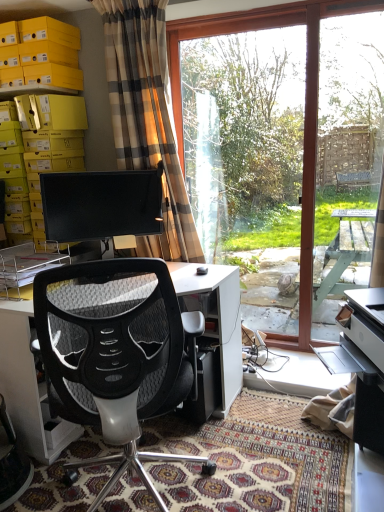
Question: From a real-world perspective, is black glossy monitor at center located beneath yellow cardboard boxes at upper left?

Choices:
 (A) yes
 (B) no

Answer: (A)

Question: Would you say black glossy monitor at center is outside yellow cardboard boxes at upper left?

Choices:
 (A) yes
 (B) no

Answer: (A)

Question: Considering the relative sizes of black glossy monitor at center and yellow cardboard boxes at upper left in the image provided, is black glossy monitor at center bigger than yellow cardboard boxes at upper left?

Choices:
 (A) yes
 (B) no

Answer: (B)

Question: Is black glossy monitor at center shorter than yellow cardboard boxes at upper left?

Choices:
 (A) no
 (B) yes

Answer: (B)

Question: Is black glossy monitor at center directly adjacent to yellow cardboard boxes at upper left?

Choices:
 (A) no
 (B) yes

Answer: (A)

Question: From their relative heights in the image, would you say black glossy monitor at center is taller or shorter than transparent glass screen door at right?

Choices:
 (A) tall
 (B) short

Answer: (B)

Question: Based on their sizes in the image, would you say black glossy monitor at center is bigger or smaller than transparent glass screen door at right?

Choices:
 (A) small
 (B) big

Answer: (A)

Question: From the image's perspective, is black glossy monitor at center above or below transparent glass screen door at right?

Choices:
 (A) above
 (B) below

Answer: (B)

Question: Is point (99, 179) positioned closer to the camera than point (369, 48)?

Choices:
 (A) farther
 (B) closer

Answer: (A)

Question: In terms of width, does transparent glass window at center look wider or thinner when compared to transparent glass screen door at right?

Choices:
 (A) thin
 (B) wide

Answer: (A)

Question: Is transparent glass window at center situated inside transparent glass screen door at right or outside?

Choices:
 (A) outside
 (B) inside

Answer: (A)

Question: From a real-world perspective, relative to transparent glass screen door at right, is transparent glass window at center vertically above or below?

Choices:
 (A) below
 (B) above

Answer: (A)

Question: Is point (362, 27) closer or farther from the camera than point (324, 337)?

Choices:
 (A) closer
 (B) farther

Answer: (A)

Question: Is white glossy printer at lower right bigger or smaller than transparent glass screen door at right?

Choices:
 (A) small
 (B) big

Answer: (A)

Question: Looking at their shapes, would you say white glossy printer at lower right is wider or thinner than transparent glass screen door at right?

Choices:
 (A) thin
 (B) wide

Answer: (B)